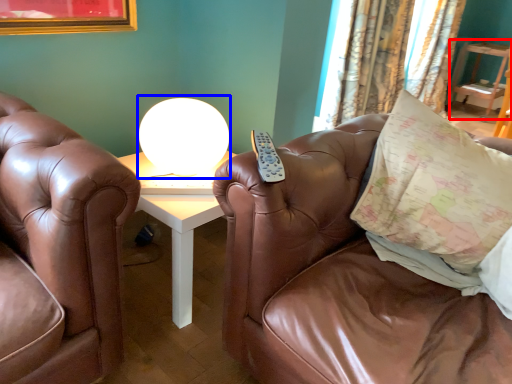
Question: Which of the following is the closest to the observer, table (highlighted by a red box) or table lamp (highlighted by a blue box)?

Choices:
 (A) table
 (B) table lamp

Answer: (B)